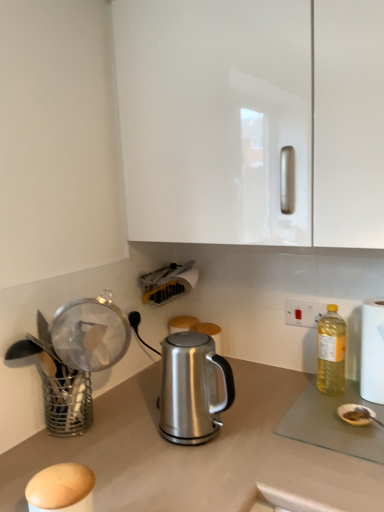
You are a GUI agent. You are given a task and a screenshot of the screen. Output one action in this format:
    pyautogui.click(x=<x>, y=<y>)
    Task: Click on the free space that is to the left of white paper towel at right
    This screenshot has width=384, height=512.
    Given the screenshot: What is the action you would take?
    pyautogui.click(x=330, y=409)